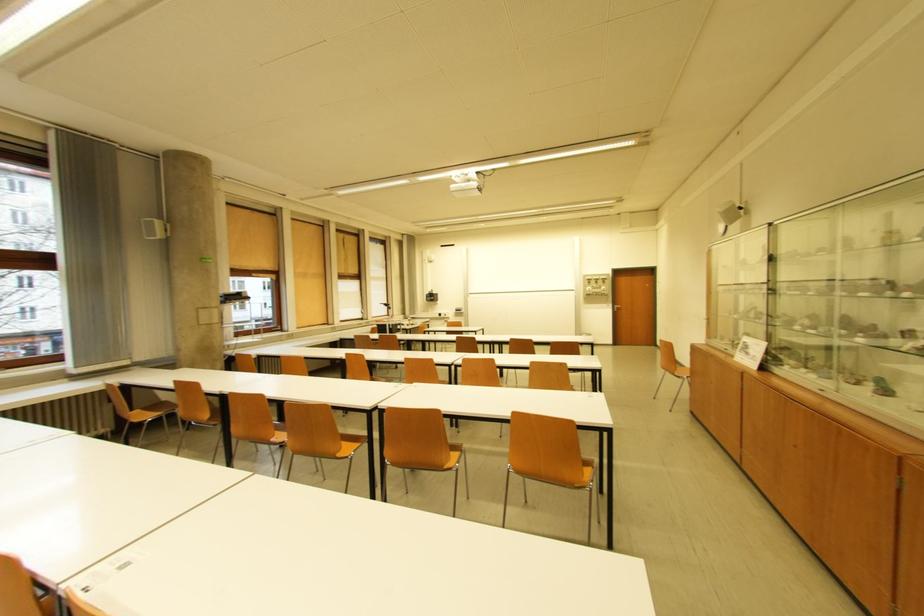
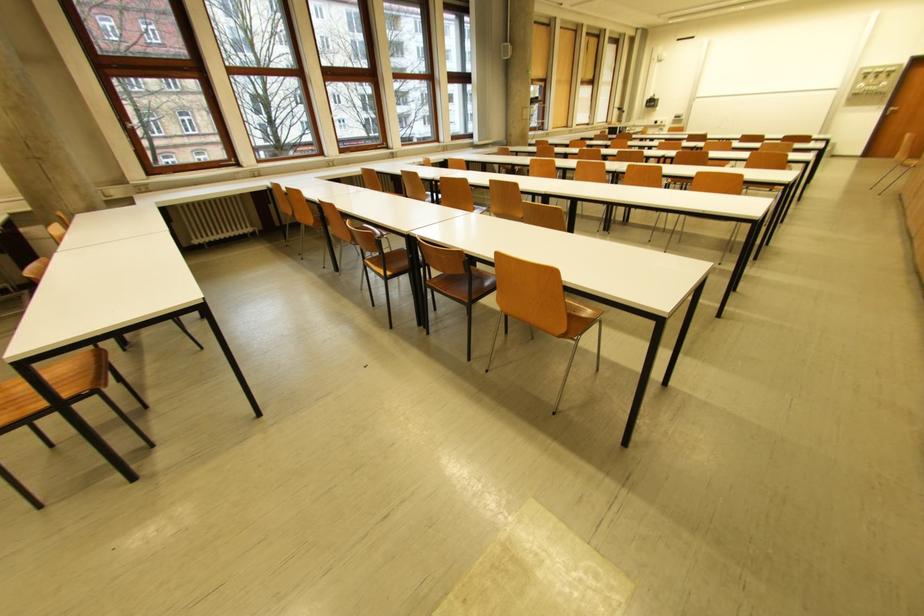
The point at (617, 306) is marked in the first image. Where is the corresponding point in the second image?

(891, 108)